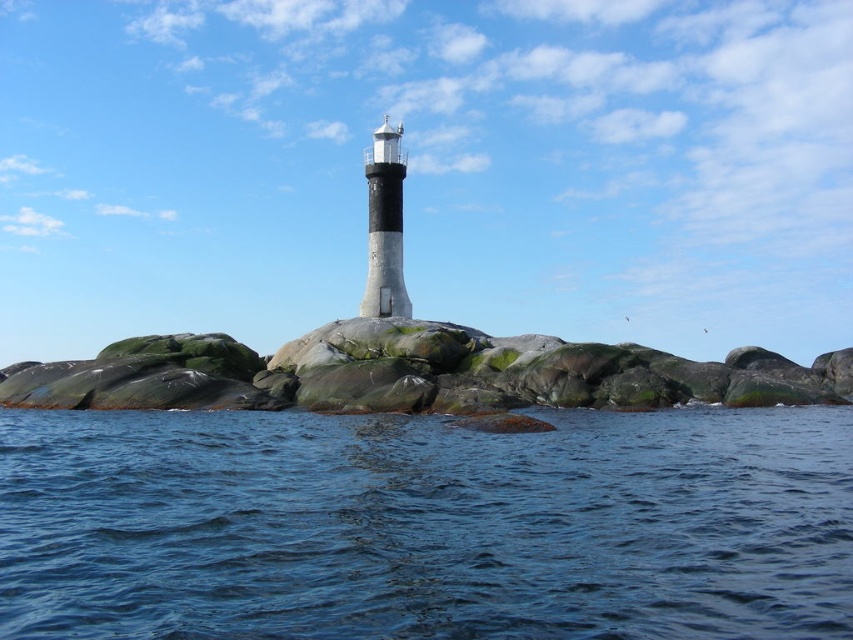
Question: Which point appears farthest from the camera in this image?

Choices:
 (A) (380, 339)
 (B) (531, 477)

Answer: (A)

Question: In this image, where is blue water at center located relative to green mossy rock at center?

Choices:
 (A) right
 (B) left

Answer: (B)

Question: Can you confirm if blue water at center is bigger than green mossy rock at center?

Choices:
 (A) yes
 (B) no

Answer: (B)

Question: Does blue water at center appear under green mossy rock at center?

Choices:
 (A) no
 (B) yes

Answer: (B)

Question: Which object is closer to the camera taking this photo?

Choices:
 (A) green mossy rock at center
 (B) blue water at center

Answer: (B)